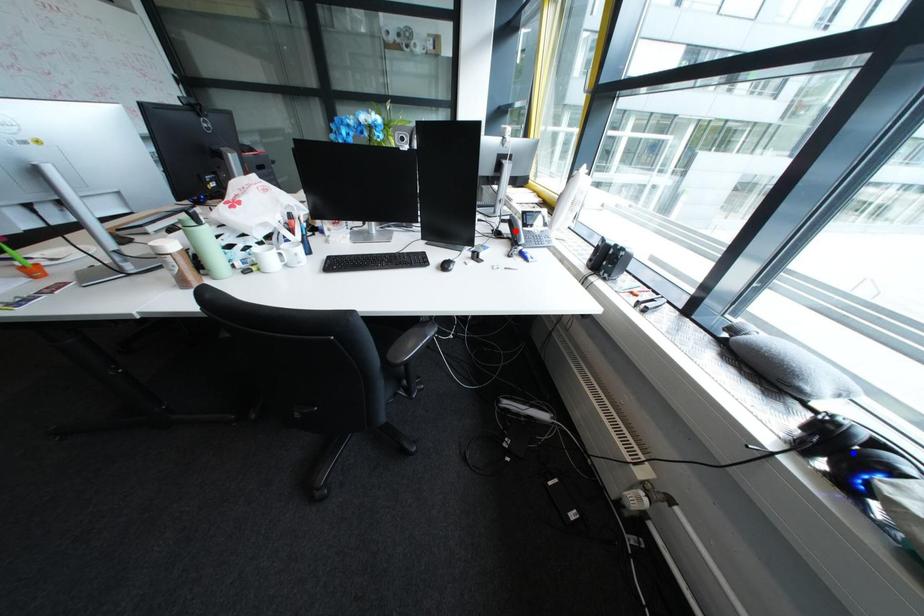
Question: In the image, two points are highlighted. Which point is nearer to the camera? Reply with the corresponding letter.

Choices:
 (A) blue point
 (B) red point

Answer: (A)